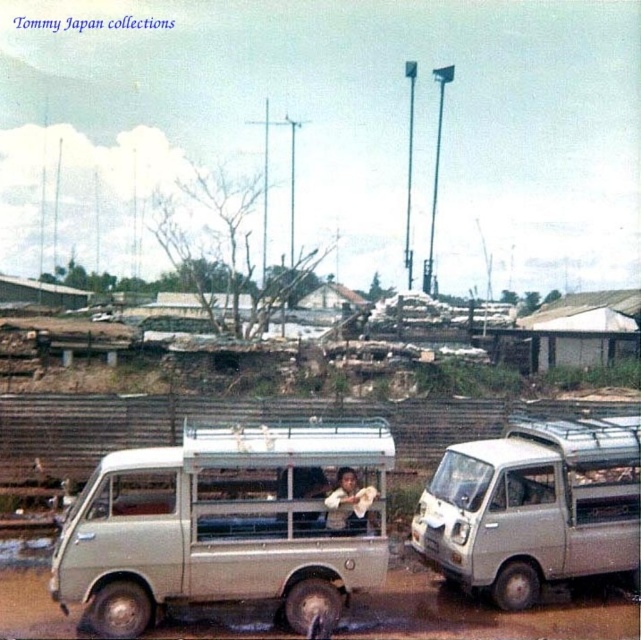
You are a delivery person needing to unload a 2.4 meter long package between the beige matte van at center and the silver metallic van at center. Can the package fit in the space between them?

The beige matte van at center and silver metallic van at center are 2.51 meters apart, so the 2.4 meter long package can fit in the space between them since it is shorter than the available distance.